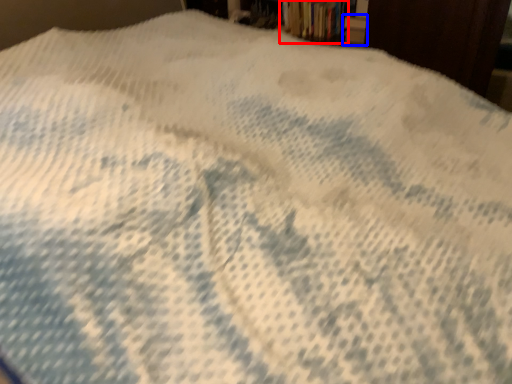
Question: Which of the following is the closest to the observer, book (highlighted by a red box) or paperback book (highlighted by a blue box)?

Choices:
 (A) book
 (B) paperback book

Answer: (B)